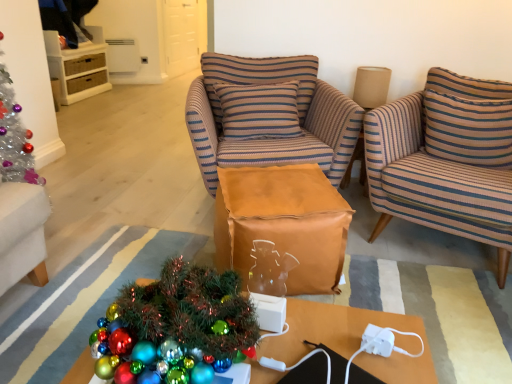
Question: Is brown paper bag at center positioned with its back to striped fabric pillow at center, the first pillow from the left?

Choices:
 (A) no
 (B) yes

Answer: (B)

Question: From the image's perspective, is brown paper bag at center below striped fabric pillow at center, arranged as the second pillow when viewed from the right?

Choices:
 (A) yes
 (B) no

Answer: (A)

Question: Is the depth of brown paper bag at center less than that of striped fabric pillow at center, the first pillow from the left?

Choices:
 (A) yes
 (B) no

Answer: (A)

Question: Can you confirm if brown paper bag at center is taller than striped fabric pillow at center, the first pillow from the left?

Choices:
 (A) yes
 (B) no

Answer: (B)

Question: Is striped fabric pillow at center, the first pillow from the left, inside brown paper bag at center?

Choices:
 (A) no
 (B) yes

Answer: (A)

Question: Is brown paper bag at center positioned beyond the bounds of striped fabric pillow at center, the first pillow from the left?

Choices:
 (A) yes
 (B) no

Answer: (A)

Question: Is shiny metallic desk at lower center bigger than white wicker cabinet at upper left?

Choices:
 (A) yes
 (B) no

Answer: (B)

Question: Is shiny metallic desk at lower center oriented away from white wicker cabinet at upper left?

Choices:
 (A) no
 (B) yes

Answer: (A)

Question: Is shiny metallic desk at lower center positioned far away from white wicker cabinet at upper left?

Choices:
 (A) no
 (B) yes

Answer: (B)

Question: Is shiny metallic desk at lower center beside white wicker cabinet at upper left?

Choices:
 (A) no
 (B) yes

Answer: (A)

Question: Would you say shiny metallic desk at lower center contains white wicker cabinet at upper left?

Choices:
 (A) no
 (B) yes

Answer: (A)

Question: Is shiny metallic desk at lower center shorter than white wicker cabinet at upper left?

Choices:
 (A) no
 (B) yes

Answer: (B)

Question: Are striped fabric armchair at right, positioned as the first chair in right-to-left order, and brown paper bag at center far apart?

Choices:
 (A) yes
 (B) no

Answer: (B)